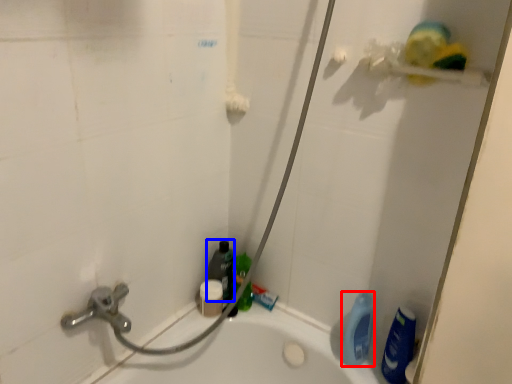
Question: Which point is further to the camera, cleaning product (highlighted by a red box) or cleaning product (highlighted by a blue box)?

Choices:
 (A) cleaning product
 (B) cleaning product

Answer: (B)